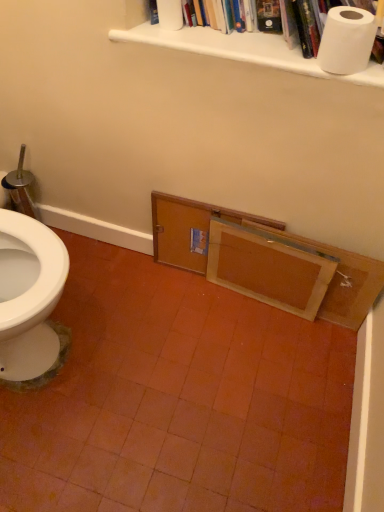
Question: From the image's perspective, is wooden drawer at center, which is the 1th drawer from right to left, on top of wooden cabinet at lower right?

Choices:
 (A) yes
 (B) no

Answer: (B)

Question: From a real-world perspective, is wooden drawer at center, the second drawer from the left, physically above wooden cabinet at lower right?

Choices:
 (A) no
 (B) yes

Answer: (B)

Question: Can wooden cabinet at lower right be found inside wooden drawer at center, which is the 1th drawer from right to left?

Choices:
 (A) yes
 (B) no

Answer: (B)

Question: Is wooden drawer at center, which is the 1th drawer from right to left, next to wooden cabinet at lower right and touching it?

Choices:
 (A) yes
 (B) no

Answer: (A)

Question: Considering the relative positions of wooden drawer at center, which is the 1th drawer from right to left, and wooden cabinet at lower right in the image provided, is wooden drawer at center, which is the 1th drawer from right to left, to the right of wooden cabinet at lower right from the viewer's perspective?

Choices:
 (A) no
 (B) yes

Answer: (B)

Question: Based on their positions, is white matte toilet paper at upper center, marked as the 2th toilet paper in a bottom-to-top arrangement, located to the left or right of wooden drawer at center, which is the 1th drawer from right to left?

Choices:
 (A) left
 (B) right

Answer: (A)

Question: From a real-world perspective, is white matte toilet paper at upper center, the second toilet paper positioned from the front, above or below wooden drawer at center, which is the 1th drawer from right to left?

Choices:
 (A) above
 (B) below

Answer: (A)

Question: In terms of height, does white matte toilet paper at upper center, marked as the 2th toilet paper in a bottom-to-top arrangement, look taller or shorter compared to wooden drawer at center, the second drawer from the left?

Choices:
 (A) tall
 (B) short

Answer: (B)

Question: From the image's perspective, relative to wooden drawer at center, which is the 1th drawer from right to left, is white matte toilet paper at upper center, which is counted as the 1th toilet paper, starting from the back, above or below?

Choices:
 (A) below
 (B) above

Answer: (B)

Question: From a real-world perspective, is wooden drawer at lower center, the 1th drawer positioned from the left, physically located above or below white paper towel at upper center?

Choices:
 (A) above
 (B) below

Answer: (B)

Question: Based on their positions, is wooden drawer at lower center, which is counted as the 2th drawer, starting from the right, located to the left or right of white paper towel at upper center?

Choices:
 (A) left
 (B) right

Answer: (A)

Question: Relative to white paper towel at upper center, is wooden drawer at lower center, the 1th drawer positioned from the left, in front or behind?

Choices:
 (A) behind
 (B) front

Answer: (A)

Question: From their relative heights in the image, would you say wooden drawer at lower center, the 1th drawer positioned from the left, is taller or shorter than white paper towel at upper center?

Choices:
 (A) tall
 (B) short

Answer: (A)

Question: From a real-world perspective, is wooden cabinet at lower right physically located above or below white matte toilet paper at upper center, which is the 2th toilet paper in right-to-left order?

Choices:
 (A) below
 (B) above

Answer: (A)

Question: Is point (345, 252) positioned closer to the camera than point (157, 2)?

Choices:
 (A) closer
 (B) farther

Answer: (B)